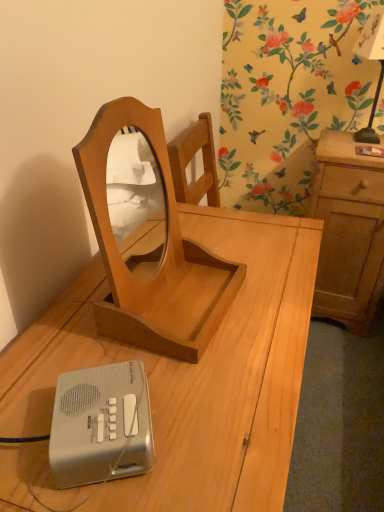
Question: Can you confirm if black glass bedside lamp at upper right is shorter than silver plastic ipod at lower left?

Choices:
 (A) yes
 (B) no

Answer: (B)

Question: From a real-world perspective, is black glass bedside lamp at upper right physically above silver plastic ipod at lower left?

Choices:
 (A) no
 (B) yes

Answer: (B)

Question: Can you confirm if black glass bedside lamp at upper right is thinner than silver plastic ipod at lower left?

Choices:
 (A) no
 (B) yes

Answer: (A)

Question: From the image's perspective, does black glass bedside lamp at upper right appear higher than silver plastic ipod at lower left?

Choices:
 (A) yes
 (B) no

Answer: (A)

Question: Is silver plastic ipod at lower left inside black glass bedside lamp at upper right?

Choices:
 (A) yes
 (B) no

Answer: (B)

Question: Would you say black glass bedside lamp at upper right is outside silver plastic ipod at lower left?

Choices:
 (A) no
 (B) yes

Answer: (B)

Question: From a real-world perspective, is black glass bedside lamp at upper right under light wood desk at center?

Choices:
 (A) yes
 (B) no

Answer: (B)

Question: Is black glass bedside lamp at upper right in front of light wood desk at center?

Choices:
 (A) no
 (B) yes

Answer: (A)

Question: Is black glass bedside lamp at upper right facing away from light wood desk at center?

Choices:
 (A) yes
 (B) no

Answer: (B)

Question: From the image's perspective, is black glass bedside lamp at upper right beneath light wood desk at center?

Choices:
 (A) no
 (B) yes

Answer: (A)

Question: Considering the relative sizes of black glass bedside lamp at upper right and light wood desk at center in the image provided, is black glass bedside lamp at upper right wider than light wood desk at center?

Choices:
 (A) yes
 (B) no

Answer: (B)

Question: From the image's perspective, is black glass bedside lamp at upper right above light wood desk at center?

Choices:
 (A) yes
 (B) no

Answer: (A)

Question: Can you confirm if light brown wood cabinet at right is taller than silver plastic ipod at lower left?

Choices:
 (A) yes
 (B) no

Answer: (A)